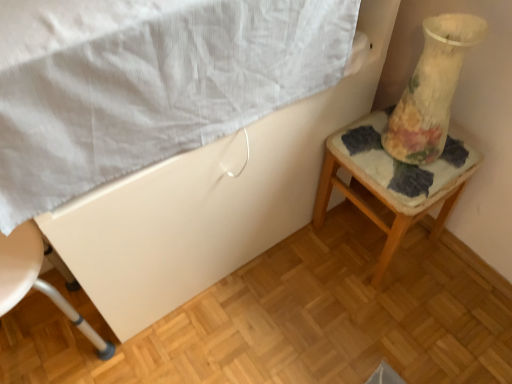
Question: From the image's perspective, would you say floral-patterned glass at right is shown under white textured sheet at upper left?

Choices:
 (A) no
 (B) yes

Answer: (B)

Question: Considering the relative positions of floral-patterned glass at right and white textured sheet at upper left in the image provided, is floral-patterned glass at right to the right of white textured sheet at upper left from the viewer's perspective?

Choices:
 (A) no
 (B) yes

Answer: (B)

Question: Is white textured sheet at upper left completely or partially inside floral-patterned glass at right?

Choices:
 (A) no
 (B) yes

Answer: (A)

Question: From a real-world perspective, does floral-patterned glass at right sit lower than white textured sheet at upper left?

Choices:
 (A) yes
 (B) no

Answer: (A)

Question: Considering the relative positions of floral-patterned glass at right and white textured sheet at upper left in the image provided, is floral-patterned glass at right to the left of white textured sheet at upper left from the viewer's perspective?

Choices:
 (A) no
 (B) yes

Answer: (A)

Question: Looking at the image, does white plastic chair at lower left seem bigger or smaller compared to floral-patterned glass at right?

Choices:
 (A) big
 (B) small

Answer: (A)

Question: From the image's perspective, is white plastic chair at lower left above or below floral-patterned glass at right?

Choices:
 (A) above
 (B) below

Answer: (B)

Question: Is white plastic chair at lower left to the left or to the right of floral-patterned glass at right in the image?

Choices:
 (A) left
 (B) right

Answer: (A)

Question: Considering the positions of white plastic chair at lower left and floral-patterned glass at right in the image, is white plastic chair at lower left wider or thinner than floral-patterned glass at right?

Choices:
 (A) thin
 (B) wide

Answer: (B)

Question: From their relative heights in the image, would you say floral fabric cushion at right is taller or shorter than white plastic chair at lower left?

Choices:
 (A) short
 (B) tall

Answer: (A)

Question: From the image's perspective, is floral fabric cushion at right located above or below white plastic chair at lower left?

Choices:
 (A) below
 (B) above

Answer: (B)

Question: Looking at the image, does floral fabric cushion at right seem bigger or smaller compared to white plastic chair at lower left?

Choices:
 (A) small
 (B) big

Answer: (B)

Question: Does point (446, 203) appear closer or farther from the camera than point (5, 301)?

Choices:
 (A) farther
 (B) closer

Answer: (A)

Question: From the image's perspective, is white plastic chair at lower left above or below floral fabric cushion at right?

Choices:
 (A) above
 (B) below

Answer: (B)

Question: Based on their positions, is white plastic chair at lower left located to the left or right of floral fabric cushion at right?

Choices:
 (A) right
 (B) left

Answer: (B)